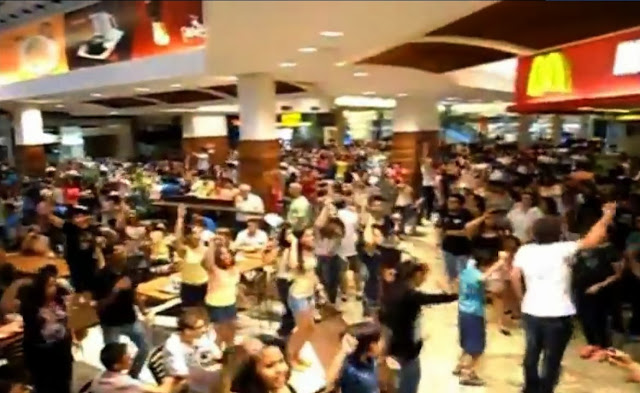
You are a GUI agent. You are given a task and a screenshot of the screen. Output one action in this format:
    pyautogui.click(x=<x>, y=<y>)
    Task: Click on the structural pillar
    This screenshot has width=640, height=393.
    Given the screenshot: What is the action you would take?
    pyautogui.click(x=264, y=157)